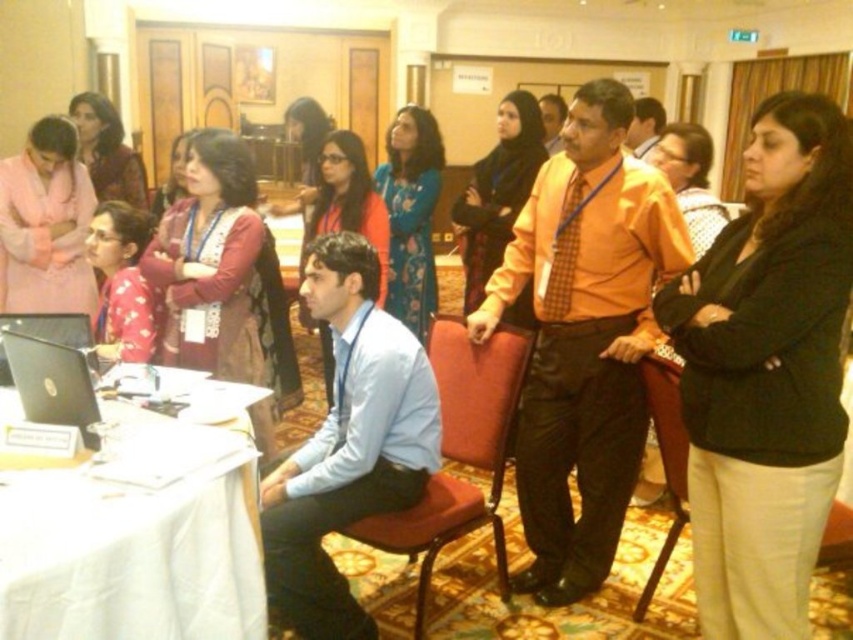
Looking at this image, is light beige fabric chair at lower right smaller than orange smooth shirt at center?

Yes, light beige fabric chair at lower right is smaller than orange smooth shirt at center.

The width and height of the screenshot is (853, 640). I want to click on light beige fabric chair at lower right, so click(665, 458).

Image resolution: width=853 pixels, height=640 pixels. In order to click on light beige fabric chair at lower right in this screenshot , I will do `click(665, 458)`.

Which is behind, point (741, 627) or point (36, 387)?

Point (36, 387)

Is point (790, 616) farther from viewer compared to point (38, 413)?

No, (790, 616) is in front of (38, 413).

Identify the location of black matte blazer at center. (767, 371).

Between orange shirt at center and white cloth-covered table at lower left, which one is positioned lower?

white cloth-covered table at lower left is lower down.

Between point (674, 211) and point (173, 621), which one is positioned behind?

Positioned behind is point (674, 211).

Identify the location of orange shirt at center. point(584,337).